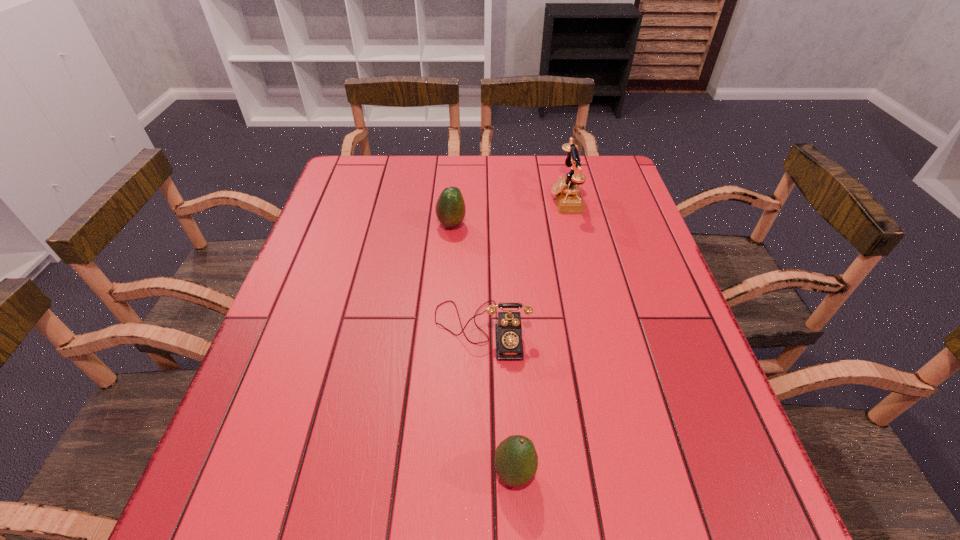
This screenshot has height=540, width=960. What are the coordinates of `free space between the farther avocado and the shorter telephone` in the screenshot? It's located at (467, 277).

At what (x,y) coordinates should I click in order to perform the action: click on free space between the left avocado and the right telephone. Please return your answer as a coordinate pair (x, y). This screenshot has height=540, width=960. Looking at the image, I should click on (509, 212).

Identify which object is located as the nearest to the nearer avocado. Please provide its 2D coordinates. Your answer should be formatted as a tuple, i.e. [(x, y)], where the tuple contains the x and y coordinates of a point satisfying the conditions above.

[(508, 332)]

Locate an element on the screen. This screenshot has width=960, height=540. object that is the closest to the farther telephone is located at coordinates (450, 209).

You are a GUI agent. You are given a task and a screenshot of the screen. Output one action in this format:
    pyautogui.click(x=<x>, y=<y>)
    Task: Click on the vacant space that satisfies the following two spatial constraints: 1. on the dial of the rightmost object; 2. on the front side of the nearest object
    The width and height of the screenshot is (960, 540).
    Given the screenshot: What is the action you would take?
    pyautogui.click(x=630, y=472)

You are a GUI agent. You are given a task and a screenshot of the screen. Output one action in this format:
    pyautogui.click(x=<x>, y=<y>)
    Task: Click on the vacant area in the image that satisfies the following two spatial constraints: 1. on the dial of the nearer avocado; 2. on the left side of the second nearest object
    
    Given the screenshot: What is the action you would take?
    pyautogui.click(x=482, y=472)

Locate an element on the screen. The image size is (960, 540). blank area in the image that satisfies the following two spatial constraints: 1. on the dial of the farther telephone; 2. on the dial of the shorter telephone is located at coordinates (596, 329).

Find the location of a particular element. The width and height of the screenshot is (960, 540). vacant position in the image that satisfies the following two spatial constraints: 1. on the dial of the taller telephone; 2. on the dial of the nearer telephone is located at coordinates (596, 329).